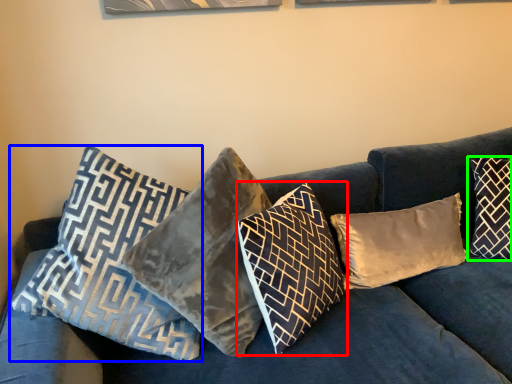
Question: Which object is positioned farthest from pillow (highlighted by a red box)? Select from pillow (highlighted by a blue box) and pillow (highlighted by a green box).

Choices:
 (A) pillow
 (B) pillow

Answer: (B)